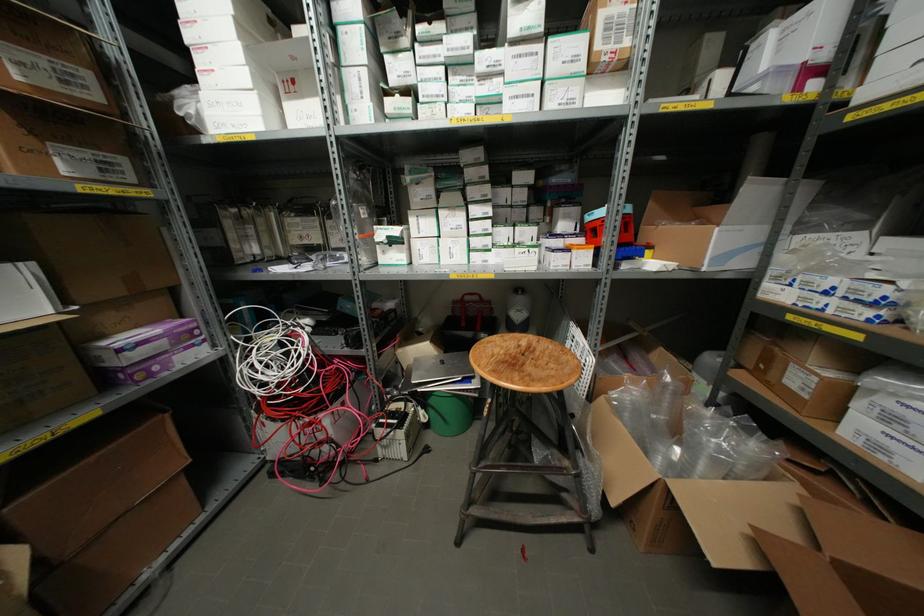
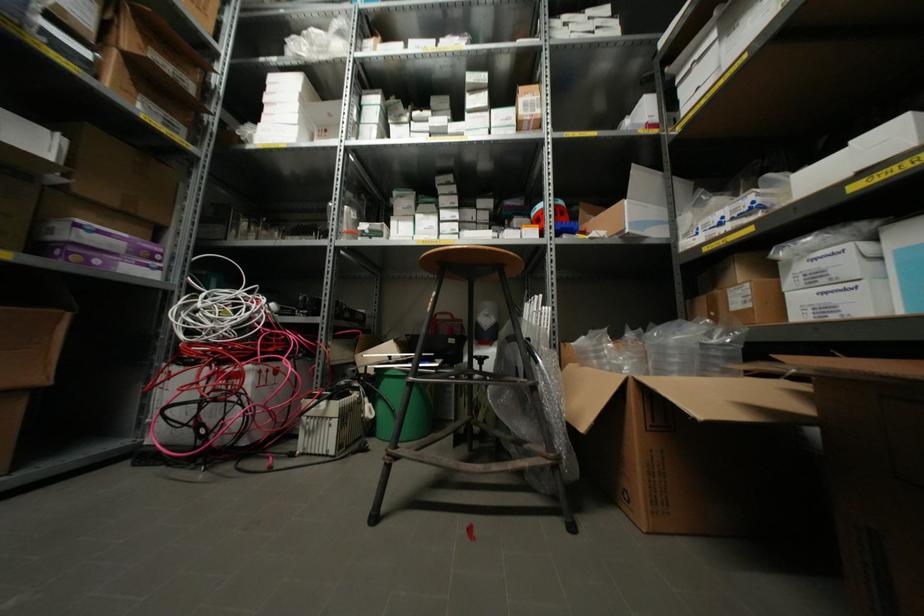
The point at (597, 45) is marked in the first image. Where is the corresponding point in the second image?

(519, 111)